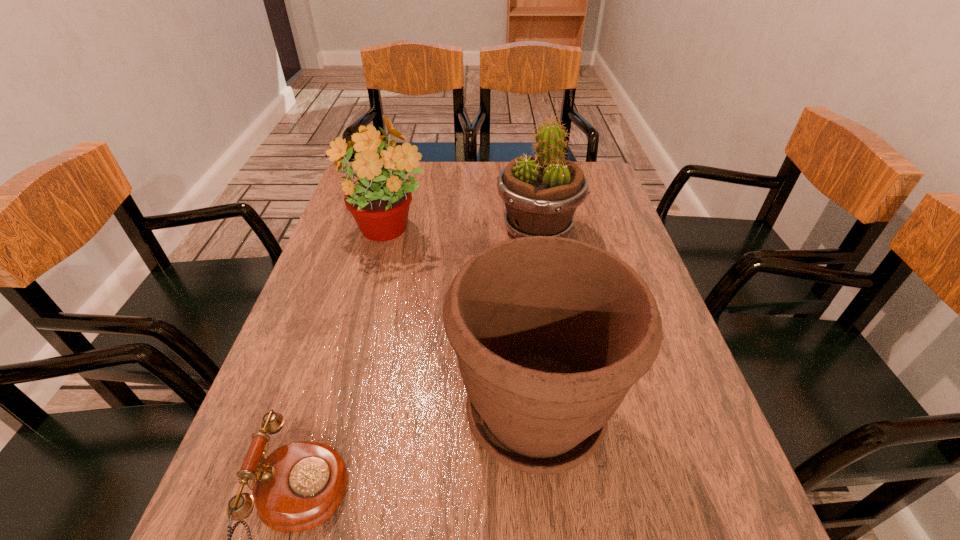
Choose which object is the third nearest neighbor to the nearest flowerpot. Please provide its 2D coordinates. Your answer should be formatted as a tuple, i.e. [(x, y)], where the tuple contains the x and y coordinates of a point satisfying the conditions above.

[(379, 202)]

Find the location of a particular element. The width and height of the screenshot is (960, 540). flowerpot that is the second closest to the leftmost flowerpot is located at coordinates (550, 333).

Choose which flowerpot is the second nearest neighbor to the nearest flowerpot. Please provide its 2D coordinates. Your answer should be formatted as a tuple, i.e. [(x, y)], where the tuple contains the x and y coordinates of a point satisfying the conditions above.

[(379, 202)]